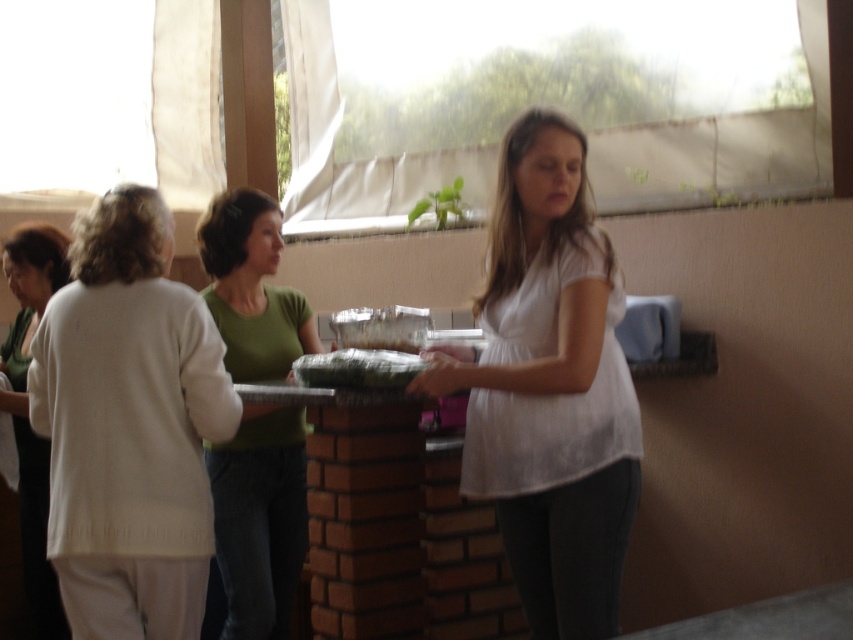
You are a photographer setting up for a group photo. You notice two people in the scene wearing a green matte shirt at center and a white sweater at left. Which clothing item has a wider silhouette when viewed from the front?

The green matte shirt at center has a wider silhouette than the white sweater at left since its width surpasses the white sweater at left.

You are standing in the room and want to reach both the point at coordinates [12,243] and the point at coordinates [350,355]. Which point will you reach first?

You will reach the point at coordinates [12,243] first because it is closer to you than the point at coordinates [350,355], which is further away.

You are standing in the room and want to place a new object at the position where the white sweater at left is currently located. Is this position on the brick structure or somewhere else in the scene?

The white sweater at left is located at point coordinates which are not on the brick structure, so placing the new object there would be somewhere else in the scene.